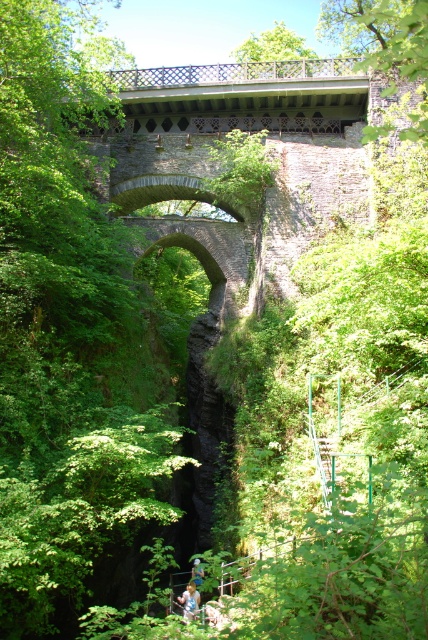
Locate an element on the screen. green leafy tree at center is located at coordinates (65, 330).

Is point (94, 118) farther from viewer compared to point (409, 28)?

That is True.

Who is more distant from viewer, (121, 228) or (353, 42)?

Point (353, 42)

This screenshot has height=640, width=428. Identify the location of green leafy tree at center. (65, 330).

Is green leafy tree at upper center bigger than white plastic helmet at center?

Correct, green leafy tree at upper center is larger in size than white plastic helmet at center.

This screenshot has width=428, height=640. Find the location of `green leafy tree at upper center`. green leafy tree at upper center is located at coordinates (273, 45).

Locate an element on the screen. green leafy tree at upper center is located at coordinates (273, 45).

Who is higher up, green leafy tree at center or green leafy tree at upper center?

green leafy tree at upper center

Is point (83, 550) behind point (249, 44)?

That is False.

This screenshot has width=428, height=640. What are the coordinates of `green leafy tree at center` in the screenshot? It's located at (65, 330).